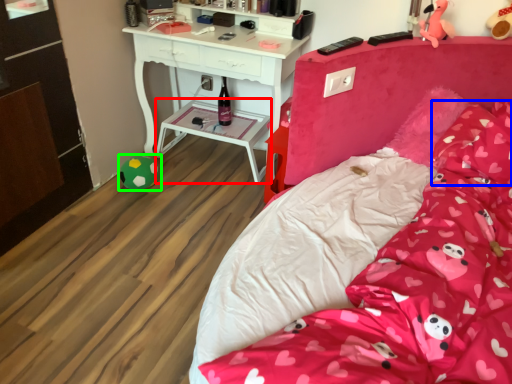
Question: Estimate the real-world distances between objects in this image. Which object is farther from side table (highlighted by a red box), pillow (highlighted by a blue box) or toy (highlighted by a green box)?

Choices:
 (A) pillow
 (B) toy

Answer: (A)